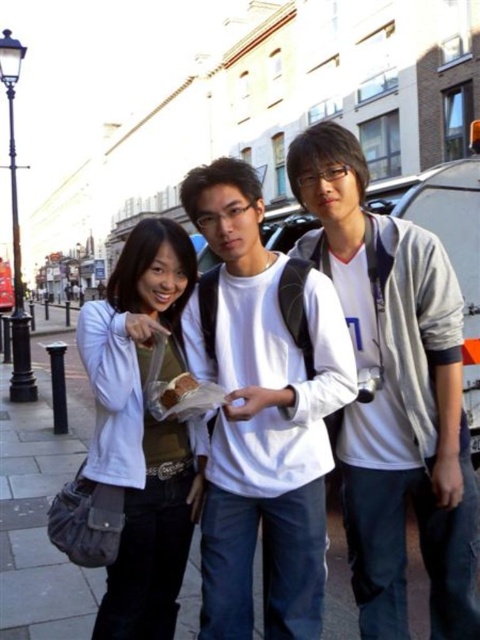
Question: Among these objects, which one is farthest from the camera?

Choices:
 (A) white matte jacket at upper left
 (B) white matte jacket at center
 (C) white cotton shirt at center

Answer: (C)

Question: Is white matte jacket at center below white matte jacket at upper left?

Choices:
 (A) no
 (B) yes

Answer: (B)

Question: Which object is positioned farthest from the white matte jacket at upper left?

Choices:
 (A) white matte jacket at center
 (B) white matte t-shirt at center

Answer: (A)

Question: Is white cotton shirt at center positioned behind white matte jacket at upper left?

Choices:
 (A) yes
 (B) no

Answer: (A)

Question: Which point is closer to the camera?

Choices:
 (A) white matte jacket at upper left
 (B) white cotton shirt at center

Answer: (A)

Question: Observing the image, what is the correct spatial positioning of white cotton shirt at center in reference to white matte jacket at upper left?

Choices:
 (A) left
 (B) right

Answer: (B)